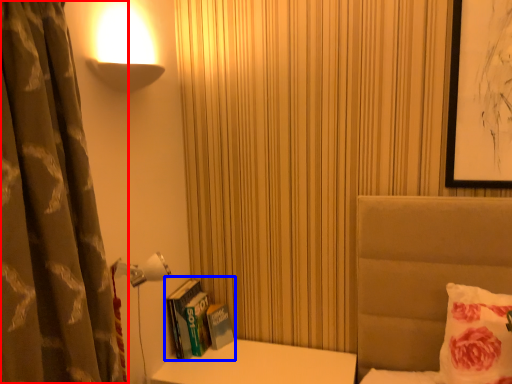
Question: Which of the following is the closest to the observer, curtain (highlighted by a red box) or book (highlighted by a blue box)?

Choices:
 (A) curtain
 (B) book

Answer: (A)